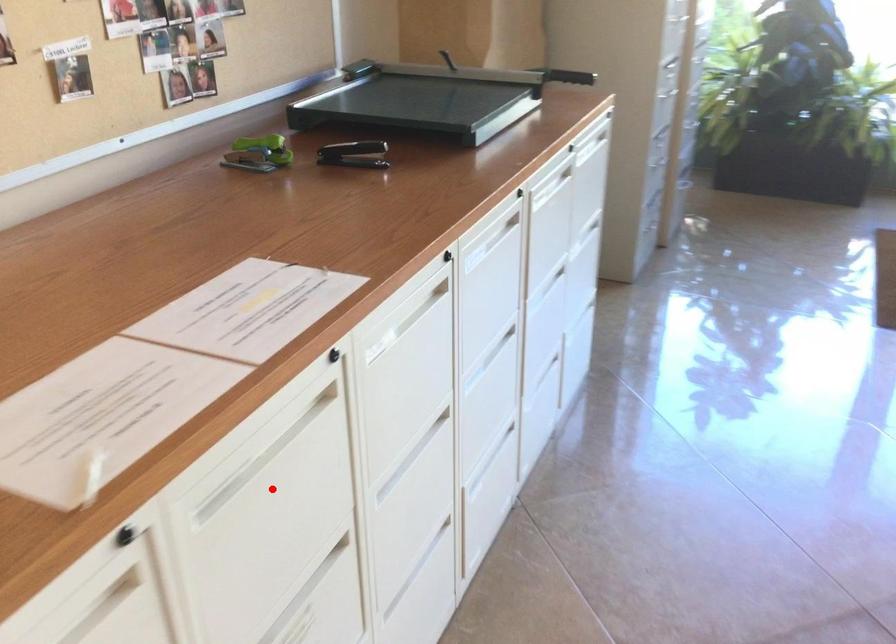
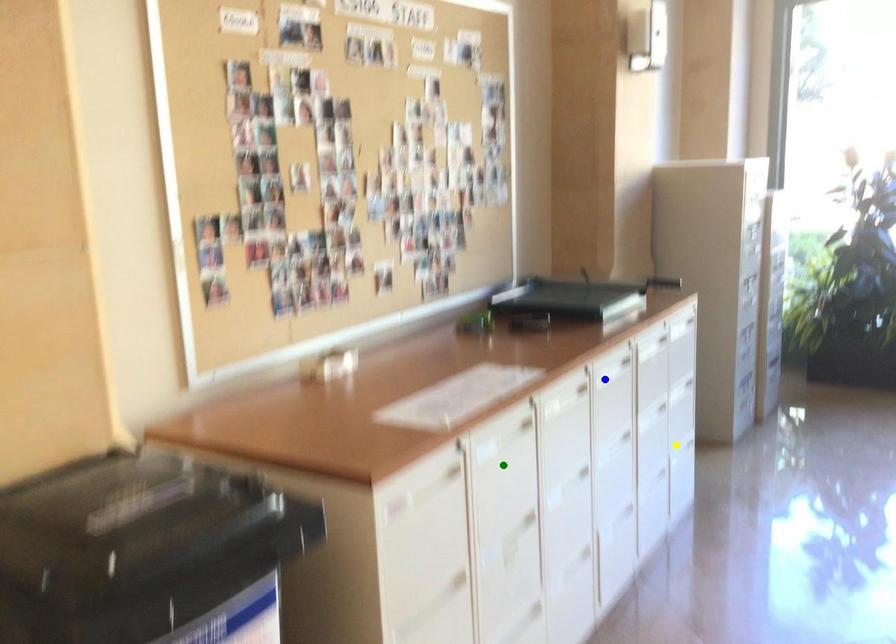
Question: I am providing you with two images of the same scene from different viewpoints. A red point is marked on the first image. You are given multiple points on the second image. Which spot in image 2 lines up with the point in image 1?

Choices:
 (A) green point
 (B) yellow point
 (C) blue point

Answer: (A)